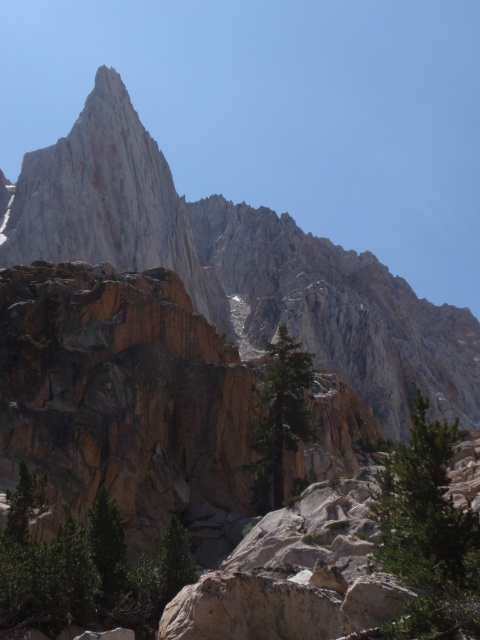
Question: Which of the following is the farthest from the observer?

Choices:
 (A) green matte tree at lower left
 (B) green textured tree at center
 (C) rugged granite peak at upper center
 (D) green textured rock at lower right

Answer: (C)

Question: Is green matte tree at lower left thinner than green textured rock at lower right?

Choices:
 (A) no
 (B) yes

Answer: (A)

Question: Is green matte tree at lower left positioned in front of green textured rock at lower right?

Choices:
 (A) no
 (B) yes

Answer: (A)

Question: Which point is closer to the camera?

Choices:
 (A) green textured rock at lower right
 (B) green matte tree at lower left
 (C) green textured tree at center

Answer: (A)

Question: Can you confirm if rugged granite peak at upper center is positioned to the right of green textured tree at center?

Choices:
 (A) no
 (B) yes

Answer: (B)

Question: Estimate the real-world distances between objects in this image. Which object is farther from the green textured rock at lower right?

Choices:
 (A) rugged granite peak at upper center
 (B) green matte tree at lower left
 (C) green textured tree at center

Answer: (A)